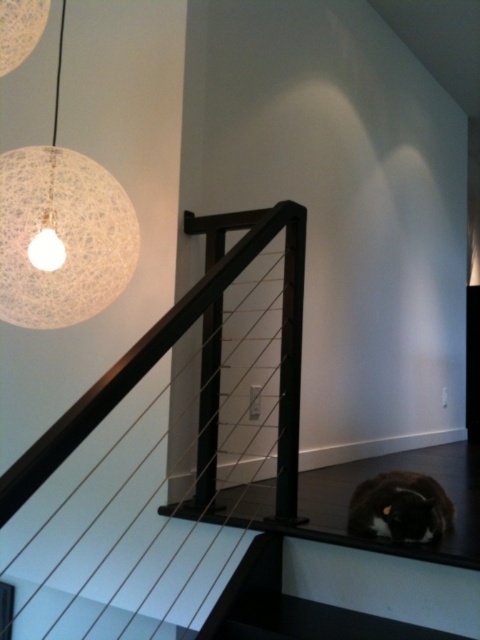
Question: Does black matte rail at upper left appear on the right side of white textured sphere at upper left?

Choices:
 (A) yes
 (B) no

Answer: (A)

Question: Which of the following is the closest to the observer?

Choices:
 (A) (99, 634)
 (B) (402, 502)

Answer: (B)

Question: Which of the following is the closest to the observer?

Choices:
 (A) white textured sphere at upper left
 (B) black fur cat at lower right
 (C) black matte rail at upper left

Answer: (C)

Question: Does black matte rail at upper left appear under white textured sphere at upper left?

Choices:
 (A) yes
 (B) no

Answer: (A)

Question: Which point is closer to the camera?

Choices:
 (A) black fur cat at lower right
 (B) white textured sphere at upper left

Answer: (A)

Question: Is white textured sphere at upper left thinner than black fur cat at lower right?

Choices:
 (A) no
 (B) yes

Answer: (A)